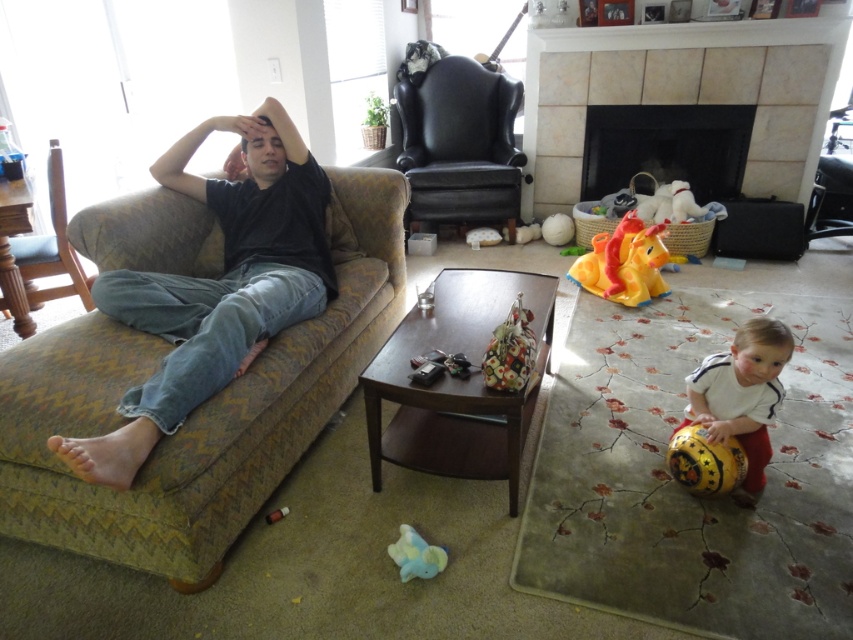
Between black tile fireplace at center and white matte toddler at lower right, which one is positioned lower?

white matte toddler at lower right is below.

You are a GUI agent. You are given a task and a screenshot of the screen. Output one action in this format:
    pyautogui.click(x=<x>, y=<y>)
    Task: Click on the black tile fireplace at center
    This screenshot has width=853, height=640.
    Given the screenshot: What is the action you would take?
    pyautogui.click(x=666, y=147)

The width and height of the screenshot is (853, 640). What are the coordinates of `black tile fireplace at center` in the screenshot? It's located at (666, 147).

Who is positioned more to the right, brown leather armchair at left or blue rubber duck at lower center?

Positioned to the right is blue rubber duck at lower center.

Is brown leather armchair at left thinner than blue rubber duck at lower center?

In fact, brown leather armchair at left might be wider than blue rubber duck at lower center.

Does point (45, 273) lie behind point (404, 538)?

That is True.

The width and height of the screenshot is (853, 640). I want to click on brown leather armchair at left, so click(51, 244).

Is black tile fireplace at center positioned at the back of brown leather armchair at left?

Yes, black tile fireplace at center is behind brown leather armchair at left.

Does black tile fireplace at center have a lesser width compared to brown leather armchair at left?

Incorrect, black tile fireplace at center's width is not less than brown leather armchair at left's.

Does point (628, 154) come in front of point (44, 260)?

No, (628, 154) is further to viewer.

Find the location of a particular element. black tile fireplace at center is located at coordinates (666, 147).